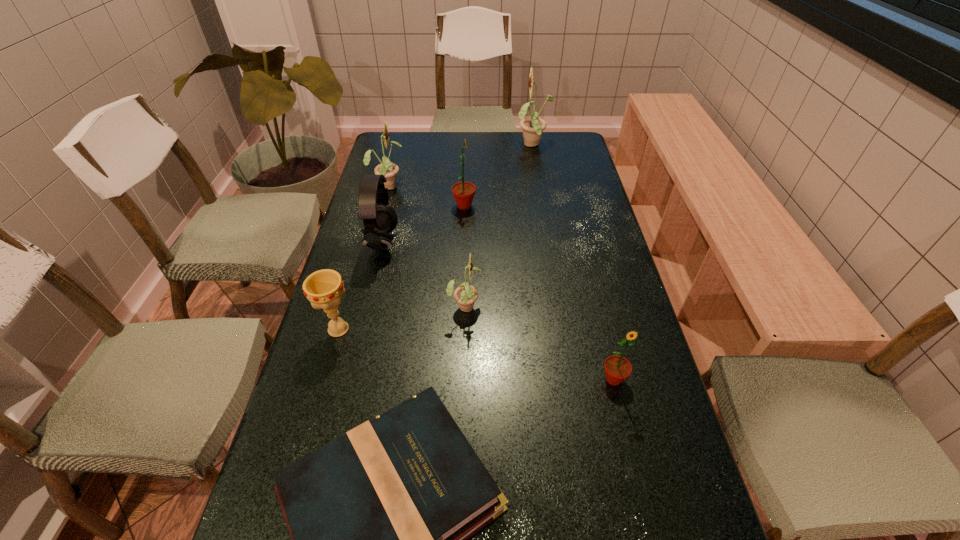
Locate an element on the screen. The width and height of the screenshot is (960, 540). free region at the far right corner is located at coordinates (x=555, y=161).

This screenshot has width=960, height=540. I want to click on empty space that is in between the third farthest object and the earphone, so click(423, 224).

Locate an element on the screen. The width and height of the screenshot is (960, 540). empty space between the second yellow sunflower from right to left and the black earphone is located at coordinates (423, 274).

I want to click on free point between the earphone and the second nearest object, so click(498, 311).

What are the coordinates of `vacant space that is in between the second yellow sunflower from left to right and the black earphone` in the screenshot? It's located at (423, 274).

I want to click on vacant area that lies between the chalice and the black earphone, so click(x=360, y=286).

The image size is (960, 540). I want to click on free point between the fourth nearest sunflower and the bigger green sunflower, so click(x=426, y=195).

At what (x,y) coordinates should I click in order to perform the action: click on empty location between the rightmost yellow sunflower and the nearer green sunflower. Please return your answer as a coordinate pair (x, y). Image resolution: width=960 pixels, height=540 pixels. Looking at the image, I should click on (573, 262).

Identify which object is located as the fifth nearest to the shortest object. Please provide its 2D coordinates. Your answer should be formatted as a tuple, i.e. [(x, y)], where the tuple contains the x and y coordinates of a point satisfying the conditions above.

[(463, 192)]

The image size is (960, 540). I want to click on object that is the second nearest to the fifth nearest object, so [463, 192].